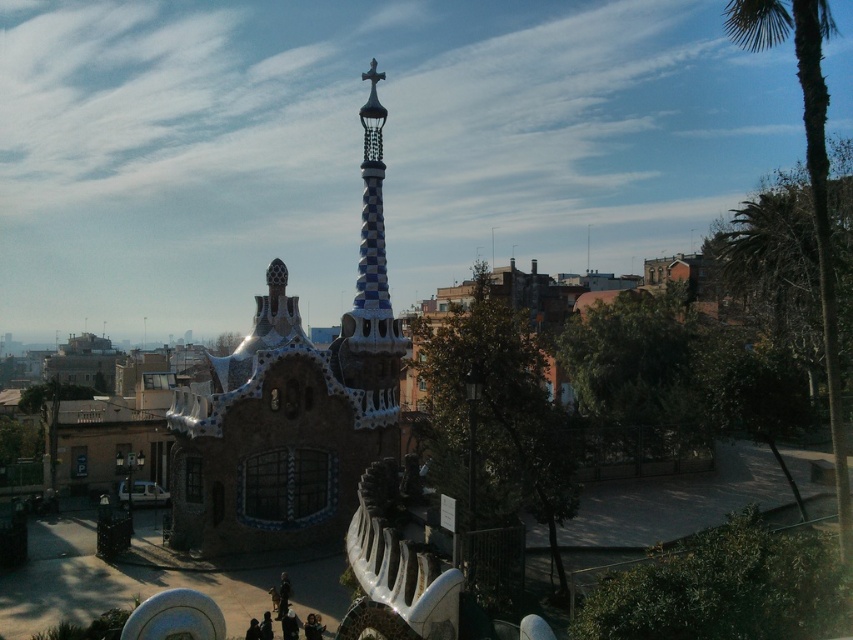
Question: In this image, where is blue mosaic tower at center located relative to checkerboard ceramic spire at center?

Choices:
 (A) above
 (B) below

Answer: (B)

Question: Is blue mosaic tower at center positioned before green leafy palm tree at right?

Choices:
 (A) no
 (B) yes

Answer: (A)

Question: Estimate the real-world distances between objects in this image. Which object is closer to the blue mosaic tower at center?

Choices:
 (A) green leafy palm tree at right
 (B) checkerboard ceramic spire at center

Answer: (B)

Question: Which point appears closest to the camera in this image?

Choices:
 (A) pos(326,381)
 (B) pos(378,346)
 (C) pos(817,0)

Answer: (C)

Question: Can you confirm if green leafy palm tree at right is positioned to the right of checkerboard ceramic spire at center?

Choices:
 (A) no
 (B) yes

Answer: (B)

Question: Estimate the real-world distances between objects in this image. Which object is closer to the green leafy palm tree at right?

Choices:
 (A) blue mosaic tower at center
 (B) checkerboard ceramic spire at center

Answer: (B)